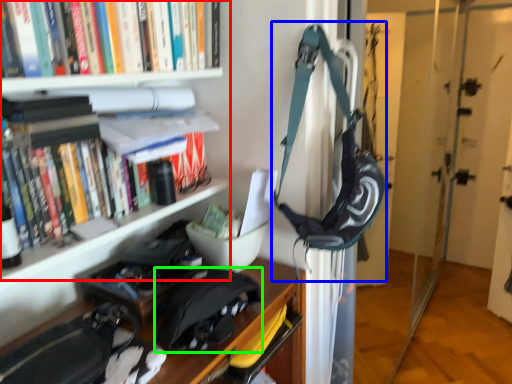
Question: Considering the real-world distances, which object is closest to bookcase (highlighted by a red box)? shoulder bag (highlighted by a blue box) or messenger bag (highlighted by a green box).

Choices:
 (A) shoulder bag
 (B) messenger bag

Answer: (A)